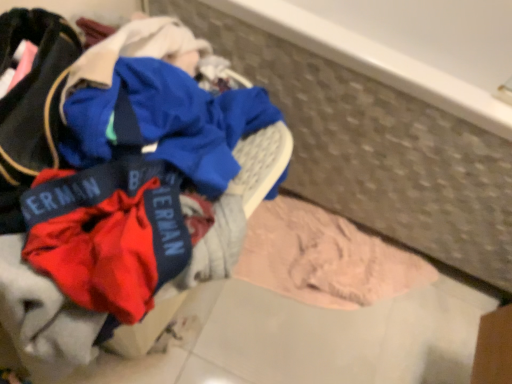
Locate an element on the screen. The height and width of the screenshot is (384, 512). vacant space underneath pink soft fabric at lower right (from a real-world perspective) is located at coordinates (357, 309).